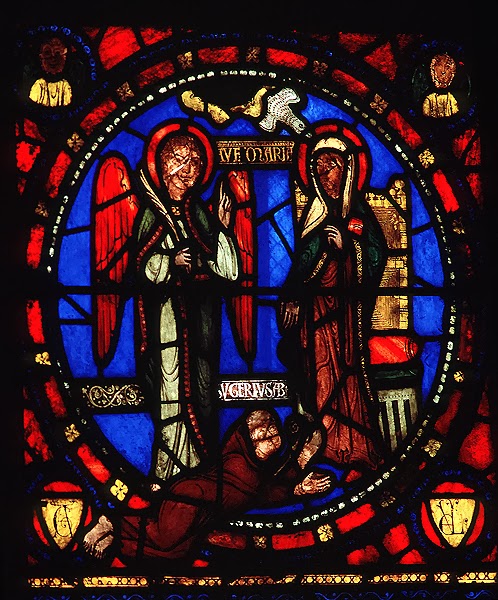
Image resolution: width=498 pixels, height=600 pixels. What are the coordinates of `chair` in the screenshot? It's located at (388, 315).